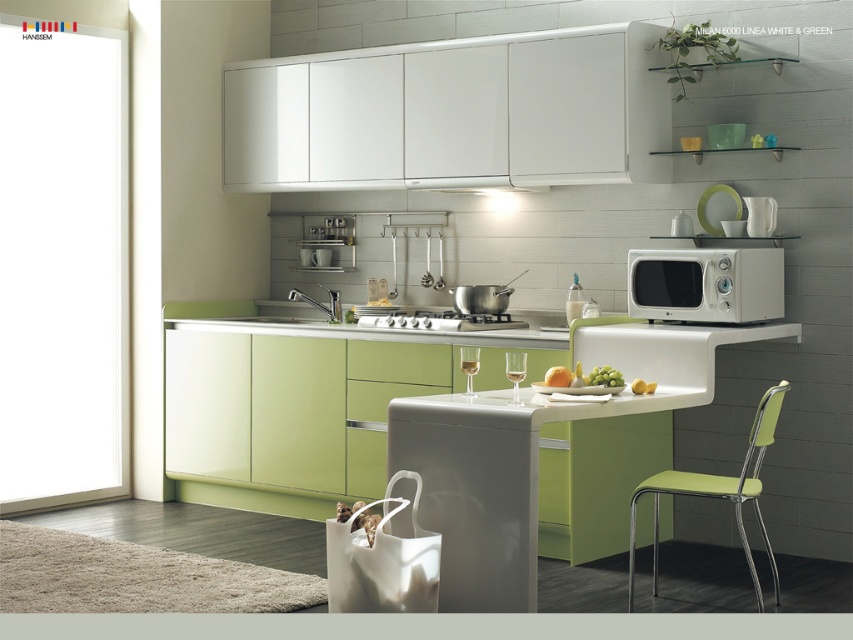
Who is lower down, stainless steel gas stove at center or green matte apple at center?

green matte apple at center is lower down.

Is point (471, 324) positioned in front of point (566, 378)?

No, it is not.

Locate an element on the screen. stainless steel gas stove at center is located at coordinates (440, 321).

What do you see at coordinates (706, 284) in the screenshot? This screenshot has height=640, width=853. I see `white matte microwave at upper right` at bounding box center [706, 284].

Does white matte microwave at upper right have a lesser width compared to stainless steel gas stove at center?

Correct, white matte microwave at upper right's width is less than stainless steel gas stove at center's.

The image size is (853, 640). I want to click on white matte microwave at upper right, so click(706, 284).

The width and height of the screenshot is (853, 640). What do you see at coordinates (706, 284) in the screenshot?
I see `white matte microwave at upper right` at bounding box center [706, 284].

This screenshot has height=640, width=853. What are the coordinates of `white matte microwave at upper right` in the screenshot? It's located at (706, 284).